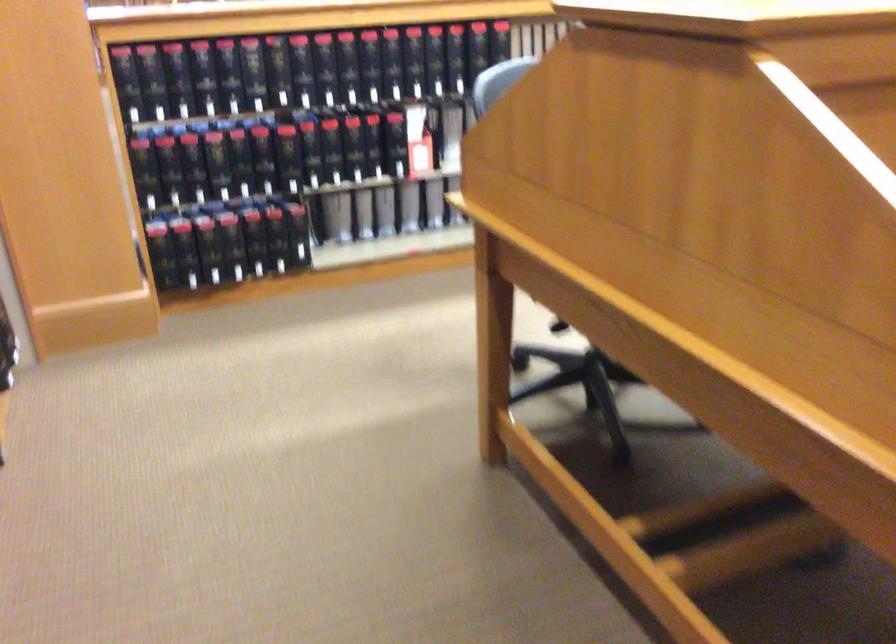
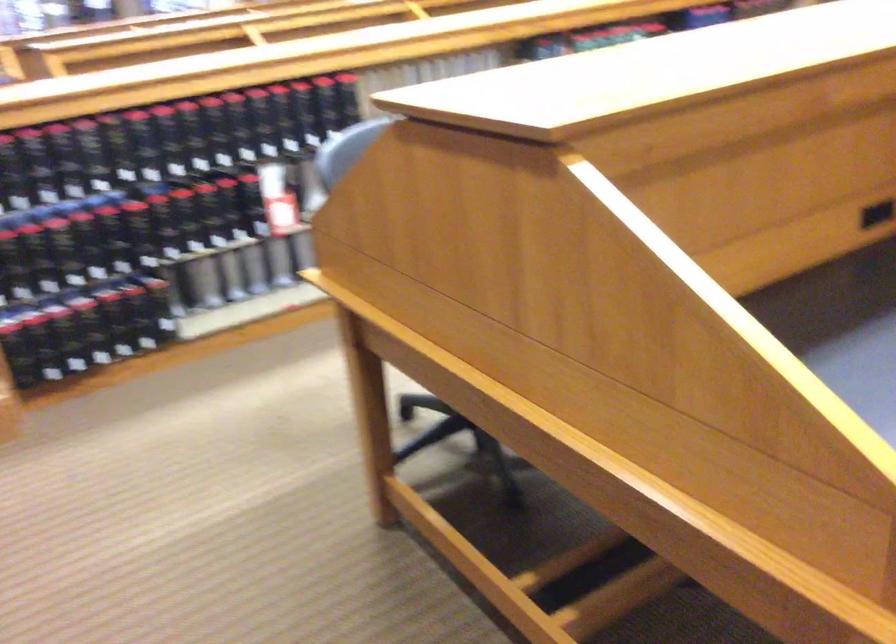
In the second image, find the point that corresponds to point 418,219 in the first image.

(288, 270)